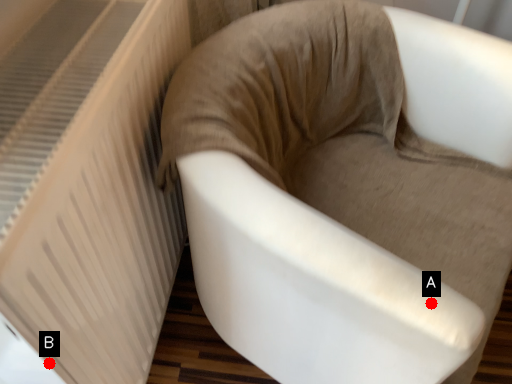
Question: Two points are circled on the image, labeled by A and B beside each circle. Which point is farther from the camera taking this photo?

Choices:
 (A) A is further
 (B) B is further

Answer: (B)